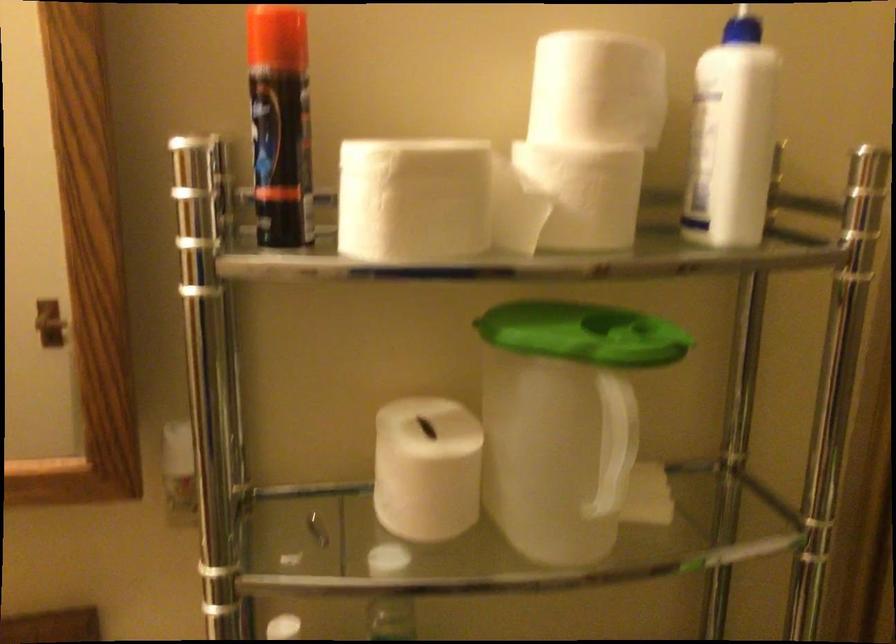
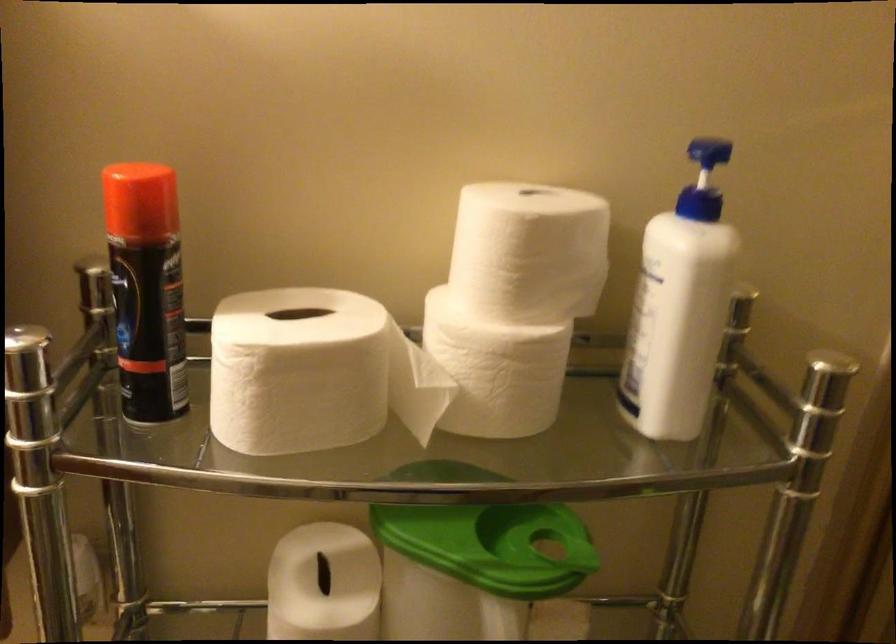
The images are taken continuously from a first-person perspective. In which direction are you moving?

The movement direction of the cameraman is right, forward.